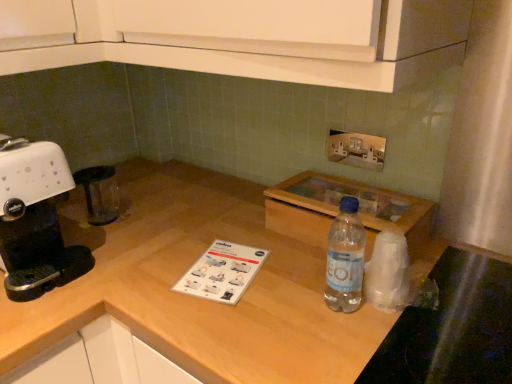
This screenshot has width=512, height=384. In order to click on free space on the front side of clear plastic bottle at center in this screenshot , I will do `click(354, 346)`.